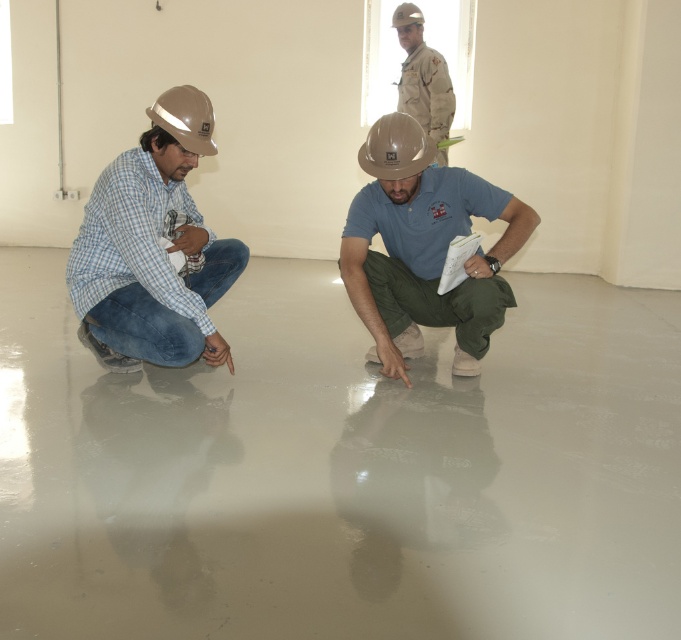
You are a safety inspector in the construction site. You need to ensure that the matte brown helmet at center is placed away from the edge of the smooth concrete floor at center. The edge is 1 meter away from the nearest wall. Can the helmet be placed safely without being too close to the edge?

The smooth concrete floor at center is wider than the matte brown helmet at center. Since the edge is 1 meter away from the nearest wall, the helmet can be placed safely within the floor area as long as it stays at least 1 meter away from the edge.

You are a safety inspector in this construction site. You need to ensure that all workers are wearing their safety gear properly. You notice the camouflage uniform at upper center and the matte brown helmet at center. Which worker is wearing the helmet correctly according to their uniform?

The camouflage uniform at upper center is located above the matte brown helmet at center, indicating that the worker in the camouflage uniform at upper center is wearing the matte brown helmet at center correctly.